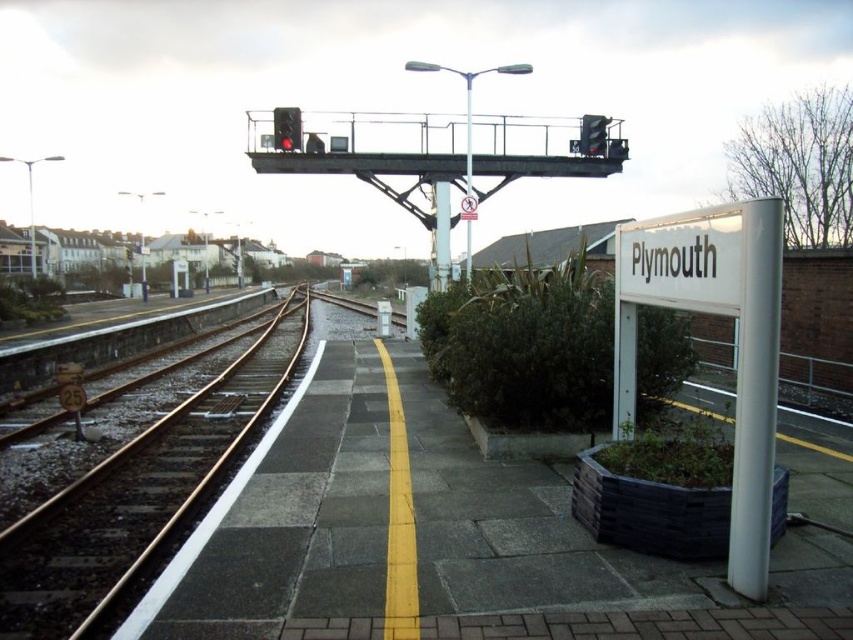
You are a railway engineer inspecting the platform. You notice two objects at the upper center of the platform. Which one is thinner between the metallic pole at upper center and the red glass traffic light at upper center?

The metallic pole at upper center is thinner than the red glass traffic light at upper center according to the description.

You are a railway engineer inspecting the platform at Plymouth station. You notice the metallic pole at upper center and the red glass traffic light at upper center. Which object is taller?

The metallic pole at upper center is much taller than the red glass traffic light at upper center.

You are standing on the Plymouth railway station platform. You see a point marked at coordinates [440,236]. What object is located at that point?

The metallic pole at center is located at point [440,236].